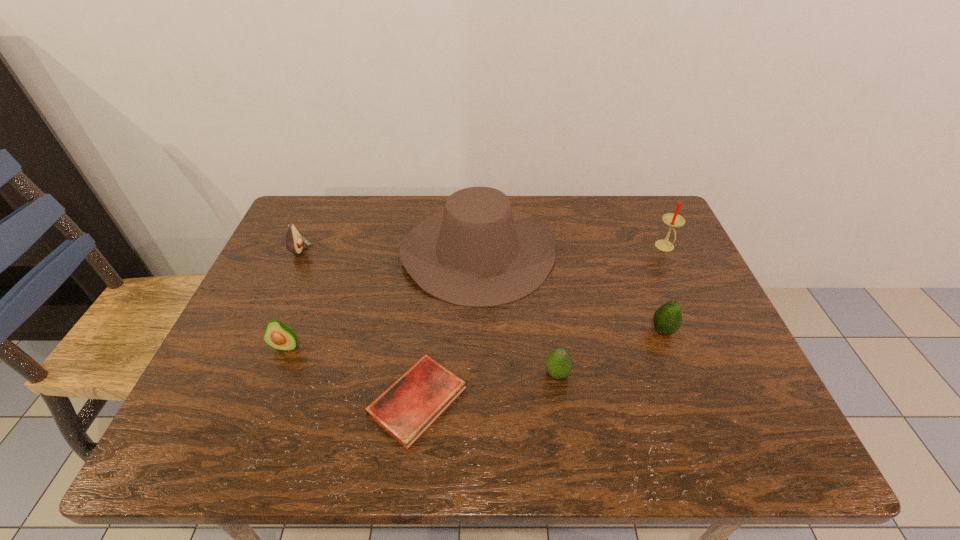
Locate an element on the screen. This screenshot has height=540, width=960. cowboy hat is located at coordinates (478, 252).

Where is `candle`? The width and height of the screenshot is (960, 540). candle is located at coordinates (673, 220).

This screenshot has height=540, width=960. Find the location of `the farthest avocado`. the farthest avocado is located at coordinates coord(294,241).

Locate an element on the screen. the leftmost avocado is located at coordinates (294, 241).

Identify the location of the third avocado from right to left. This screenshot has width=960, height=540. (280, 336).

The width and height of the screenshot is (960, 540). Find the location of `the second object from right to left`. the second object from right to left is located at coordinates (667, 319).

What are the coordinates of `the third avocado from left to right` in the screenshot? It's located at (559, 364).

Find the location of `the shortest object`. the shortest object is located at coordinates (406, 409).

Locate an element on the screen. The height and width of the screenshot is (540, 960). vacant space located on the left of the cowboy hat is located at coordinates [x=331, y=251].

The height and width of the screenshot is (540, 960). I want to click on free space located 0.250m on the front of the rightmost object, so click(x=701, y=325).